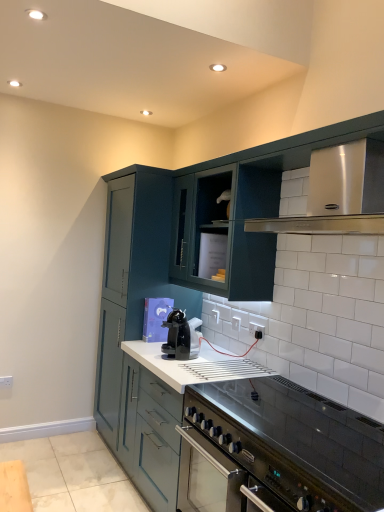
Question: From the image's perspective, would you say satin silver vent at upper right is shown under black glossy coffee machine at center?

Choices:
 (A) yes
 (B) no

Answer: (B)

Question: Does satin silver vent at upper right lie in front of black glossy coffee machine at center?

Choices:
 (A) yes
 (B) no

Answer: (A)

Question: Is satin silver vent at upper right next to black glossy coffee machine at center and touching it?

Choices:
 (A) yes
 (B) no

Answer: (B)

Question: Is satin silver vent at upper right positioned beyond the bounds of black glossy coffee machine at center?

Choices:
 (A) yes
 (B) no

Answer: (A)

Question: From a real-world perspective, is satin silver vent at upper right positioned under black glossy coffee machine at center based on gravity?

Choices:
 (A) yes
 (B) no

Answer: (B)

Question: Does point (218, 367) appear closer or farther from the camera than point (9, 377)?

Choices:
 (A) closer
 (B) farther

Answer: (A)

Question: From a real-world perspective, is white glossy countertop at center physically located above or below white plastic electric outlet at lower left, the second electric outlet in the front-to-back sequence?

Choices:
 (A) above
 (B) below

Answer: (A)

Question: From the image's perspective, relative to white plastic electric outlet at lower left, placed as the 2th electric outlet when sorted from top to bottom, is white glossy countertop at center above or below?

Choices:
 (A) above
 (B) below

Answer: (B)

Question: Would you say white glossy countertop at center is to the left or to the right of white plastic electric outlet at lower left, which appears as the second electric outlet when viewed from the right, in the picture?

Choices:
 (A) right
 (B) left

Answer: (A)

Question: From a real-world perspective, is black glossy coffee machine at center positioned above or below stainless steel oven at lower right?

Choices:
 (A) above
 (B) below

Answer: (A)

Question: In terms of width, does black glossy coffee machine at center look wider or thinner when compared to stainless steel oven at lower right?

Choices:
 (A) wide
 (B) thin

Answer: (B)

Question: Is point (163, 344) positioned closer to the camera than point (190, 410)?

Choices:
 (A) farther
 (B) closer

Answer: (A)

Question: In terms of size, does black glossy coffee machine at center appear bigger or smaller than stainless steel oven at lower right?

Choices:
 (A) small
 (B) big

Answer: (A)

Question: From a real-world perspective, is white glossy countertop at center positioned above or below satin silver vent at upper right?

Choices:
 (A) below
 (B) above

Answer: (A)

Question: Is white glossy countertop at center bigger or smaller than satin silver vent at upper right?

Choices:
 (A) small
 (B) big

Answer: (B)